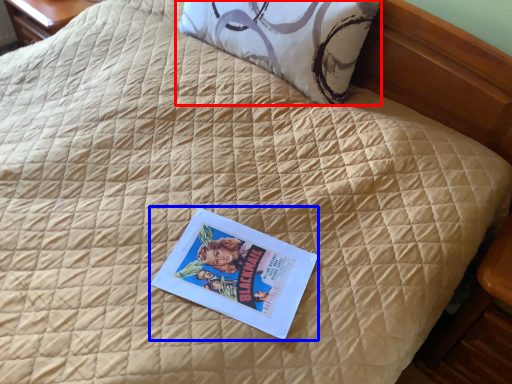
Question: Which of the following is the farthest to the observer, pillow (highlighted by a red box) or paperback book (highlighted by a blue box)?

Choices:
 (A) pillow
 (B) paperback book

Answer: (A)